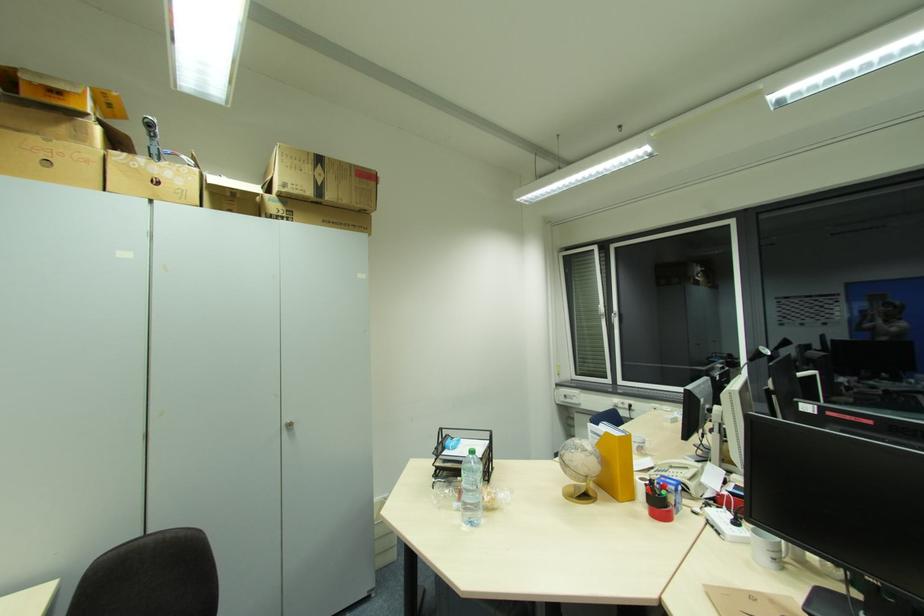
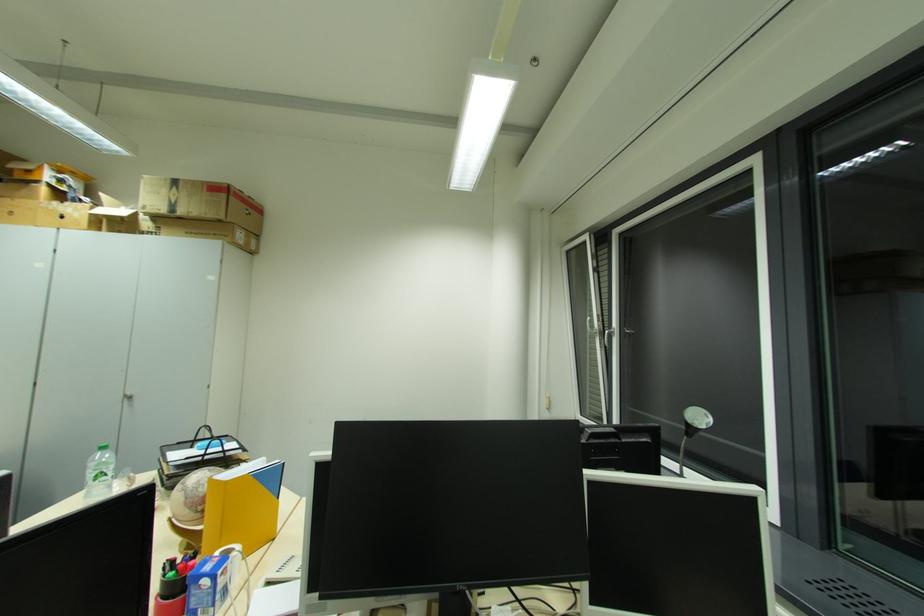
Locate, in the second image, the point that corresponds to point (293, 187) in the first image.

(152, 209)